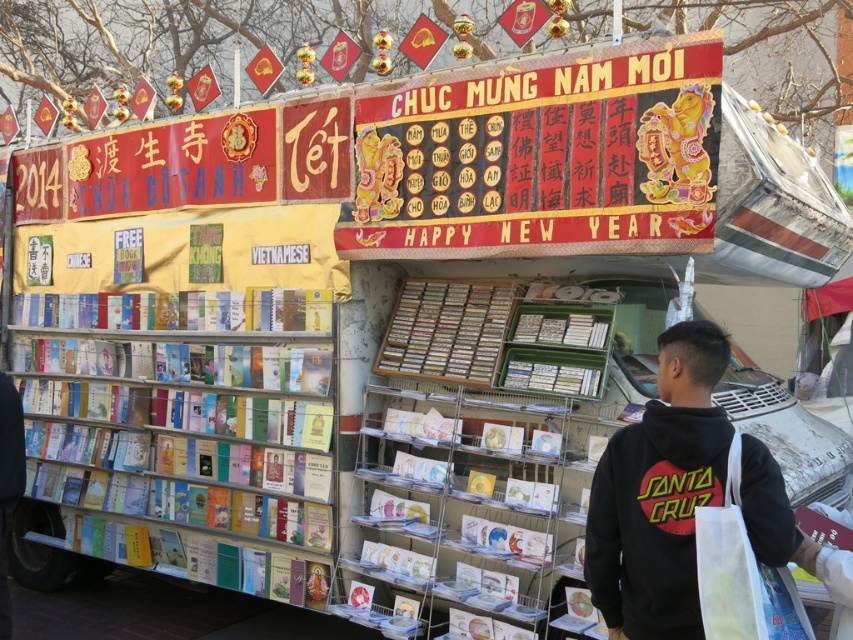
What are the coordinates of `white plastic bookshelf at left` in the screenshot? It's located at (183, 451).

Is white plastic bookshelf at left shorter than black cotton hoodie at center?

Incorrect, white plastic bookshelf at left's height does not fall short of black cotton hoodie at center's.

What do you see at coordinates (183, 451) in the screenshot? I see `white plastic bookshelf at left` at bounding box center [183, 451].

Locate an element on the screen. The image size is (853, 640). white plastic bookshelf at left is located at coordinates (183, 451).